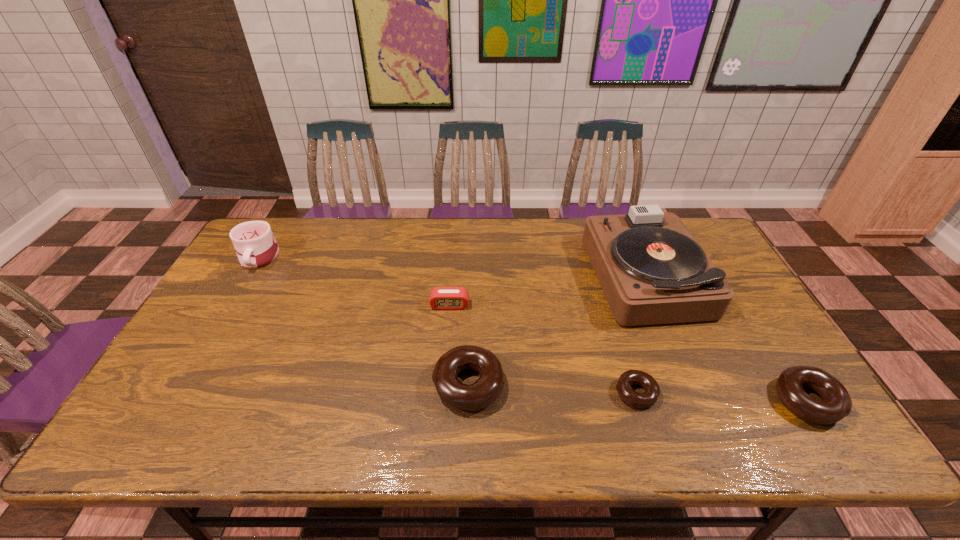
At what (x,y) coordinates should I click in order to perform the action: click on the leftmost doughnut. Please return your answer as a coordinate pair (x, y). Looking at the image, I should click on (486, 389).

At what (x,y) coordinates should I click in order to perform the action: click on the second doughnut from left to right. Please return your answer as a coordinate pair (x, y). The width and height of the screenshot is (960, 540). Looking at the image, I should click on (635, 399).

Where is `the shortest doughnut`? the shortest doughnut is located at coordinates (635, 399).

Locate an element on the screen. the rightmost doughnut is located at coordinates (836, 404).

You are a GUI agent. You are given a task and a screenshot of the screen. Output one action in this format:
    pyautogui.click(x=<x>, y=<y>)
    Task: Click on the second shortest doughnut
    This screenshot has width=960, height=540.
    Given the screenshot: What is the action you would take?
    pyautogui.click(x=836, y=404)

Where is `mug`? mug is located at coordinates (256, 247).

At what (x,y) coordinates should I click in order to perform the action: click on the fifth shortest object. Please return your answer as a coordinate pair (x, y). Looking at the image, I should click on (x=256, y=247).

In order to click on the tallest object in this screenshot , I will do `click(651, 269)`.

I want to click on alarm clock, so click(x=441, y=298).

Where is `vacant space located on the right of the leftmost doughnut`? The width and height of the screenshot is (960, 540). vacant space located on the right of the leftmost doughnut is located at coordinates (593, 385).